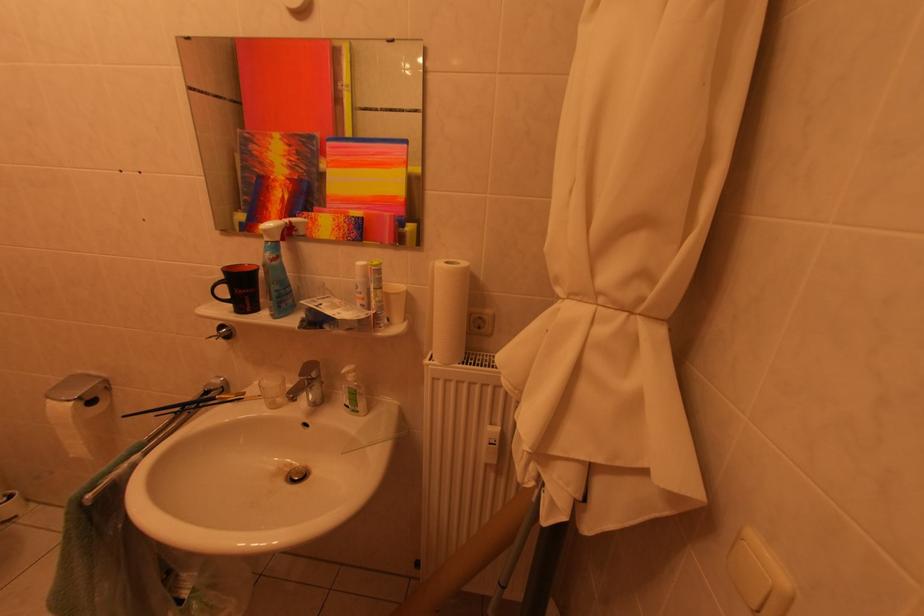
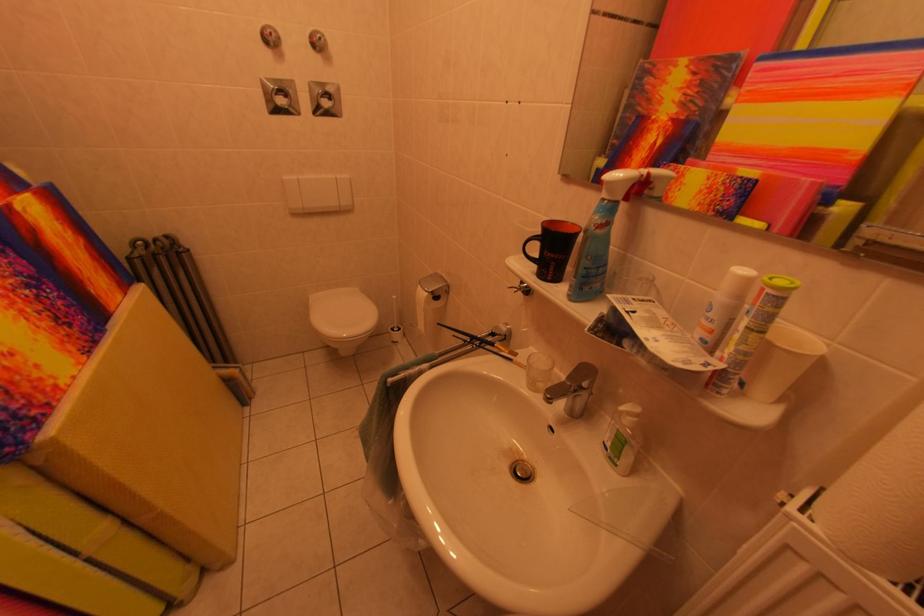
Locate, in the second image, the point that corresponds to [283,408] in the first image.

(541, 389)